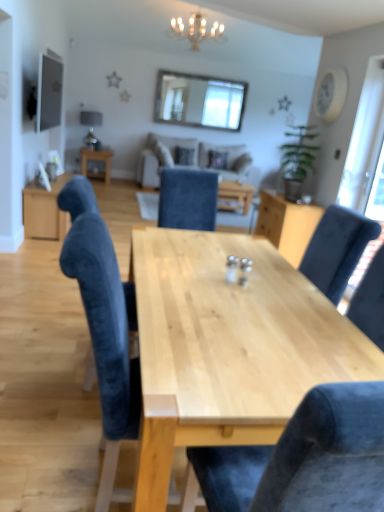
Question: Is velvet blue chair at center, arranged as the 1th chair when viewed from the back, at the left side of clear glass window at upper center, which is the 1th window screen in left-to-right order?

Choices:
 (A) no
 (B) yes

Answer: (B)

Question: Would you say velvet blue chair at center, acting as the 2th chair starting from the front, is a long distance from clear glass window at upper center, the second window screen ordered from the bottom?

Choices:
 (A) no
 (B) yes

Answer: (B)

Question: Does velvet blue chair at center, arranged as the 1th chair when viewed from the back, have a greater width compared to clear glass window at upper center, the first window screen when ordered from back to front?

Choices:
 (A) yes
 (B) no

Answer: (A)

Question: Does velvet blue chair at center, arranged as the 1th chair when viewed from the back, have a smaller size compared to clear glass window at upper center, the second window screen ordered from the bottom?

Choices:
 (A) yes
 (B) no

Answer: (B)

Question: From the image's perspective, would you say velvet blue chair at center, acting as the 2th chair starting from the front, is positioned over clear glass window at upper center, the second window screen from the front?

Choices:
 (A) no
 (B) yes

Answer: (A)

Question: Looking at the image, does transparent glass door at right, which is the first window screen from right to left, seem bigger or smaller compared to natural wood table at center, which is the first table from right to left?

Choices:
 (A) small
 (B) big

Answer: (A)

Question: Looking at their shapes, would you say transparent glass door at right, the 2th window screen from the back, is wider or thinner than natural wood table at center, the first table positioned from the bottom?

Choices:
 (A) wide
 (B) thin

Answer: (B)

Question: From a real-world perspective, is transparent glass door at right, placed as the first window screen when sorted from bottom to top, positioned above or below natural wood table at center, the first table positioned from the bottom?

Choices:
 (A) above
 (B) below

Answer: (A)

Question: Considering the relative positions of transparent glass door at right, placed as the first window screen when sorted from bottom to top, and natural wood table at center, the first table positioned from the bottom, in the image provided, is transparent glass door at right, placed as the first window screen when sorted from bottom to top, to the left or to the right of natural wood table at center, the first table positioned from the bottom,?

Choices:
 (A) left
 (B) right

Answer: (B)

Question: In terms of size, does velvet blue chair at center, the second chair when ordered from back to front, appear bigger or smaller than crystal chandelier at upper center?

Choices:
 (A) small
 (B) big

Answer: (A)

Question: In the image, is velvet blue chair at center, the second chair when ordered from back to front, on the left side or the right side of crystal chandelier at upper center?

Choices:
 (A) right
 (B) left

Answer: (B)

Question: In the image, is velvet blue chair at center, which is the first chair in front-to-back order, positioned in front of or behind crystal chandelier at upper center?

Choices:
 (A) front
 (B) behind

Answer: (A)

Question: Looking at their shapes, would you say velvet blue chair at center, which is the first chair in front-to-back order, is wider or thinner than crystal chandelier at upper center?

Choices:
 (A) wide
 (B) thin

Answer: (B)

Question: From the image's perspective, is clear glass window at upper center, marked as the 2th window screen in a right-to-left arrangement, positioned above or below beige fabric couch at center?

Choices:
 (A) above
 (B) below

Answer: (A)

Question: Considering the positions of point (211, 95) and point (205, 142), is point (211, 95) closer or farther from the camera than point (205, 142)?

Choices:
 (A) closer
 (B) farther

Answer: (A)